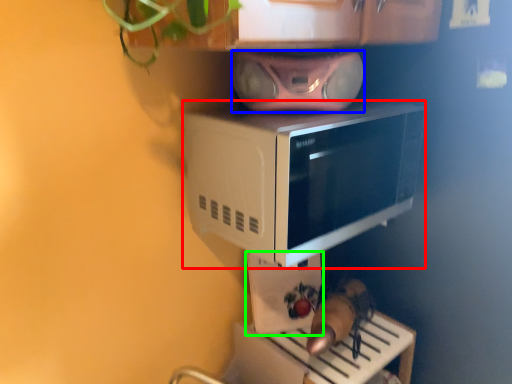
Question: Estimate the real-world distances between objects in this image. Which object is closer to microwave oven (highlighted by a red box), stereo (highlighted by a blue box) or appliance (highlighted by a green box)?

Choices:
 (A) stereo
 (B) appliance

Answer: (B)